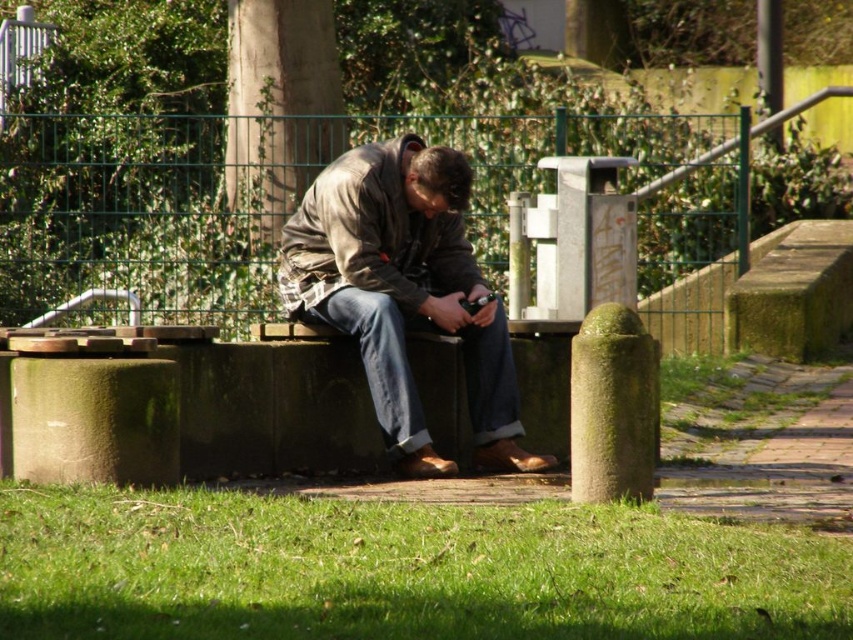
Does denim jacket at center have a greater height compared to brown textured jacket at center?

Correct, denim jacket at center is much taller as brown textured jacket at center.

Is denim jacket at center positioned before brown textured jacket at center?

Yes.

Is point (363, 273) positioned before point (317, 257)?

Yes, it is in front of point (317, 257).

Identify the location of denim jacket at center. (404, 291).